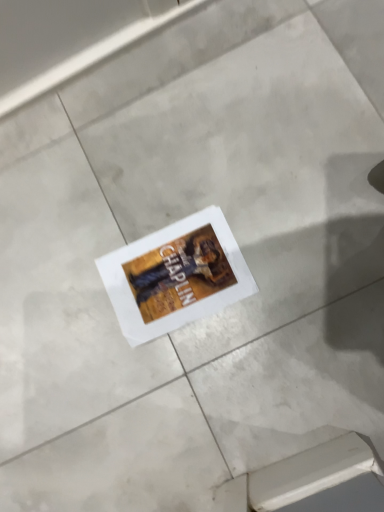
What is the approximate width of white paper magazine at center?

It is 11.72 inches.

Find the location of `white paper magazine at center`. white paper magazine at center is located at coordinates (175, 276).

What do you see at coordinates (175, 276) in the screenshot?
I see `white paper magazine at center` at bounding box center [175, 276].

In order to face white paper magazine at center, should I rotate leftwards or rightwards?

Turn left approximately 1.896 degrees to face it.

What is the approximate height of white paper magazine at center?

The height of white paper magazine at center is 0.39 inches.

Find the location of a particular element. white paper magazine at center is located at coordinates (x=175, y=276).